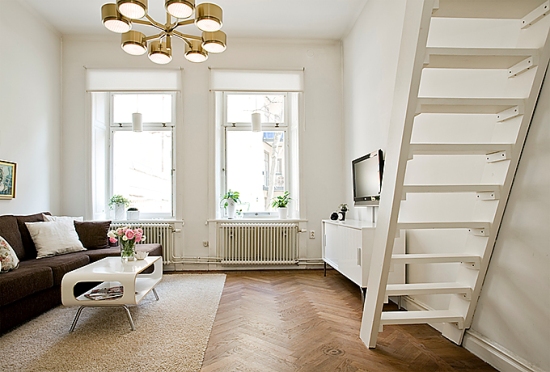
Where is `windows in the back`? The height and width of the screenshot is (372, 550). windows in the back is located at coordinates (101, 227), (133, 161), (243, 164).